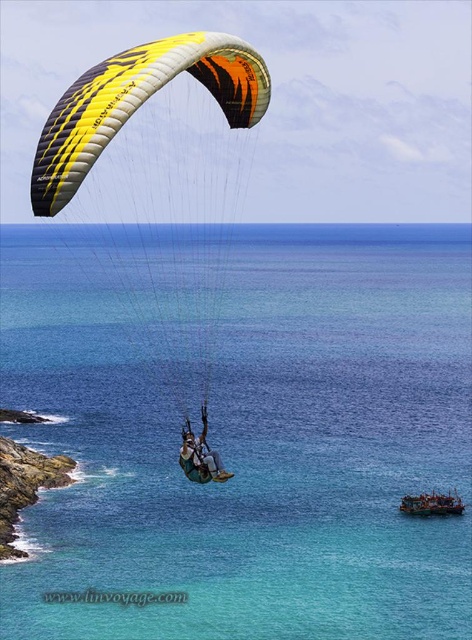
You are a paraglider pilot preparing to land near the transparent blue water at center and the rocky cliff at lower left. Which object should you avoid landing on due to its location relative to the other?

You should avoid landing on the rocky cliff at lower left because the transparent blue water at center is positioned on the right side of it, meaning the cliff is to the left and may be a safer landing spot. Wait, no, the question says to avoid landing on the one due to its location relative to the other. Hmm, need to check the description again. The description says the water is on the right side of the cliff. So the cliff is on the left, and the water is to the right. If the pilot wants to land, they need

Looking at this image, you are a paraglider pilot preparing to land. You see the rocky cliff at lower left and the matte yellow parachute at upper center. Which object is positioned higher in the sky?

The matte yellow parachute at upper center is positioned higher in the sky than the rocky cliff at lower left.